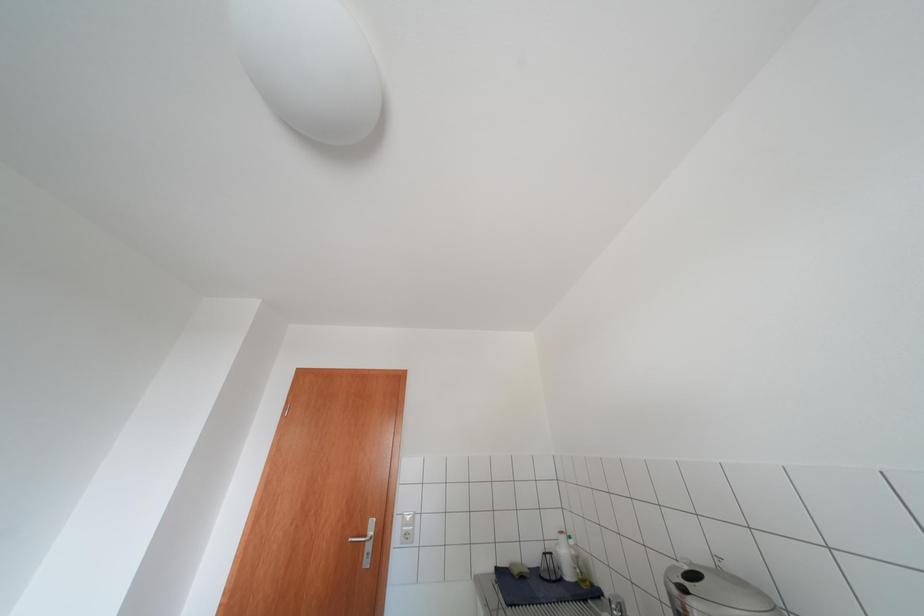
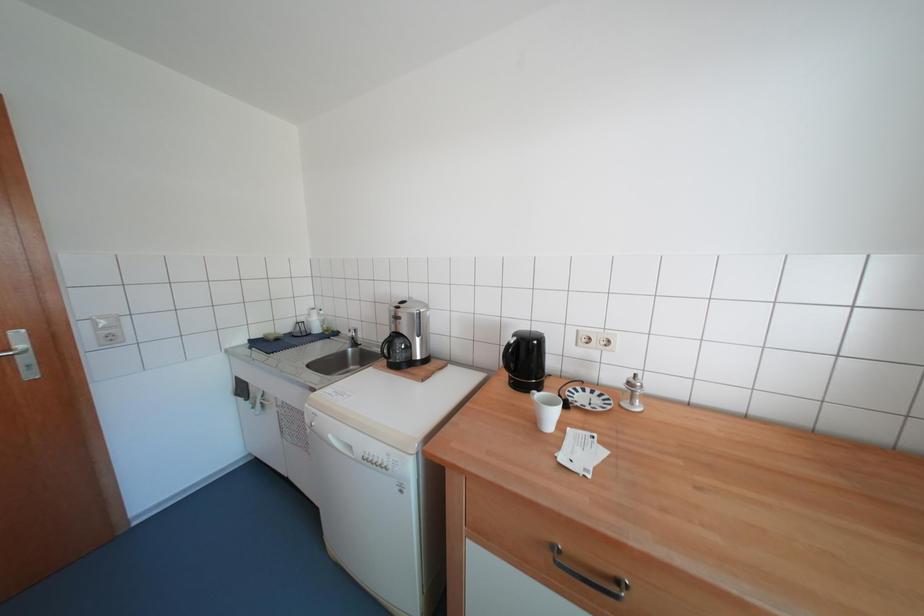
Based on the continuous images, in which direction is the camera rotating?

The camera rotated toward right-down.